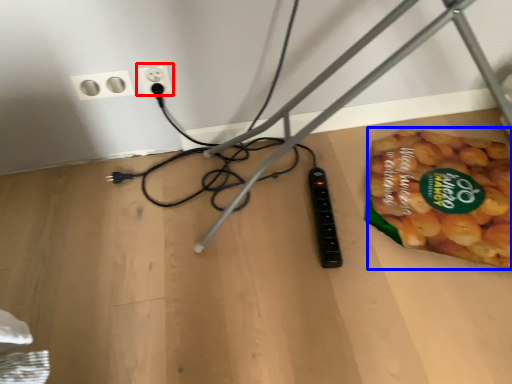
Question: Which of the following is the farthest to the observer, power plugs and sockets (highlighted by a red box) or food (highlighted by a blue box)?

Choices:
 (A) power plugs and sockets
 (B) food

Answer: (A)